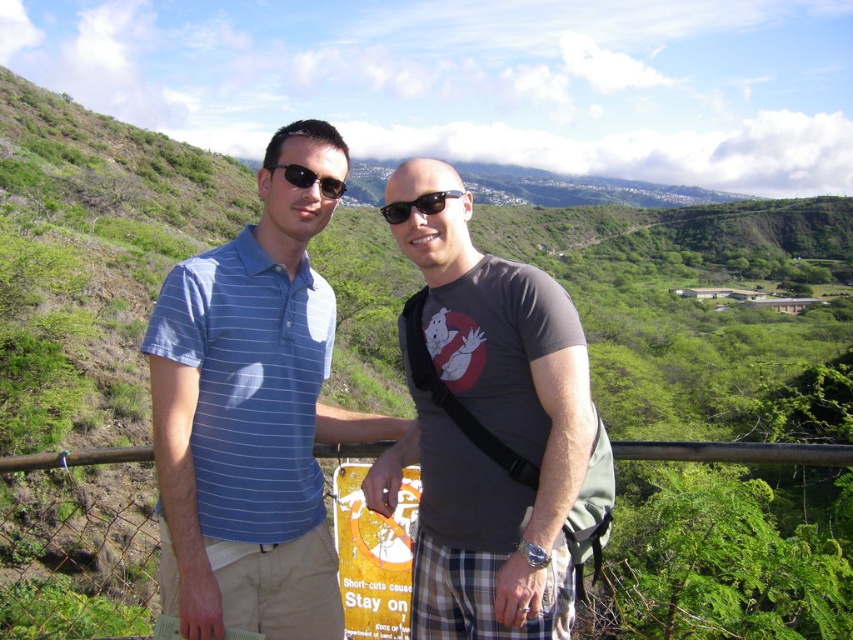
Is blue striped polo shirt at center smaller than matte black sunglasses at center?

Actually, blue striped polo shirt at center might be larger than matte black sunglasses at center.

Between blue striped polo shirt at center and matte black sunglasses at center, which one is positioned lower?

blue striped polo shirt at center is below.

Locate an element on the screen. Image resolution: width=853 pixels, height=640 pixels. blue striped polo shirt at center is located at coordinates (252, 413).

Is blue striped polo shirt at center wider than dark gray t-shirt at center?

Indeed, blue striped polo shirt at center has a greater width compared to dark gray t-shirt at center.

Based on the photo, who is higher up, blue striped polo shirt at center or dark gray t-shirt at center?

blue striped polo shirt at center

Identify the location of blue striped polo shirt at center. (252, 413).

You are a GUI agent. You are given a task and a screenshot of the screen. Output one action in this format:
    pyautogui.click(x=<x>, y=<y>)
    Task: Click on the blue striped polo shirt at center
    
    Given the screenshot: What is the action you would take?
    pyautogui.click(x=252, y=413)

Can you confirm if dark gray t-shirt at center is positioned below matte black sunglasses at center?

Yes.

Which is in front, point (560, 417) or point (289, 177)?

Point (560, 417)

The height and width of the screenshot is (640, 853). I want to click on dark gray t-shirt at center, so click(x=492, y=435).